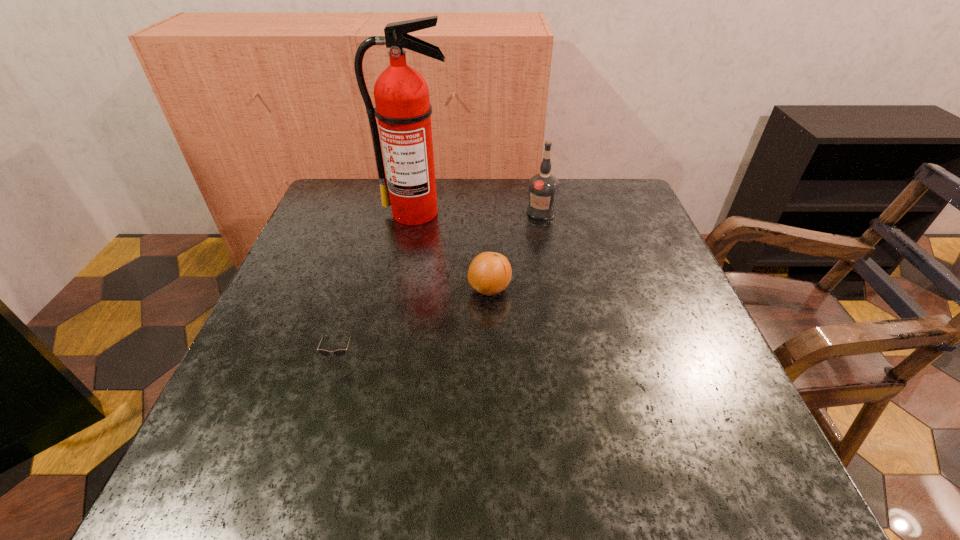
Where is `the tallest object`? The image size is (960, 540). the tallest object is located at coordinates (403, 109).

Where is `the rightmost object`? The height and width of the screenshot is (540, 960). the rightmost object is located at coordinates (543, 187).

Find the location of `the third shortest object`. the third shortest object is located at coordinates coord(543,187).

Where is `orange`? Image resolution: width=960 pixels, height=540 pixels. orange is located at coordinates (489, 273).

Find the location of `the second object from right to left`. the second object from right to left is located at coordinates tap(489, 273).

Identify the location of the nearest object. The image size is (960, 540). (341, 352).

Find the location of a particular element. The height and width of the screenshot is (540, 960). the shortest object is located at coordinates (341, 352).

Locate an element on the screen. The image size is (960, 540). vacant area situated on the side of the tallest object near the handle is located at coordinates (393, 334).

Where is `vacant space located on the front label of the rightmost object`? Image resolution: width=960 pixels, height=540 pixels. vacant space located on the front label of the rightmost object is located at coordinates (550, 261).

Identify the location of free space located on the back of the second nearest object. This screenshot has height=540, width=960. (489, 257).